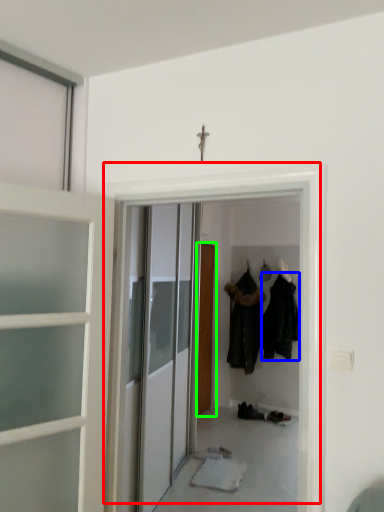
Question: Which object is the farthest from door (highlighted by a red box)? Choose among these: clothing (highlighted by a blue box) or door (highlighted by a green box).

Choices:
 (A) clothing
 (B) door

Answer: (A)